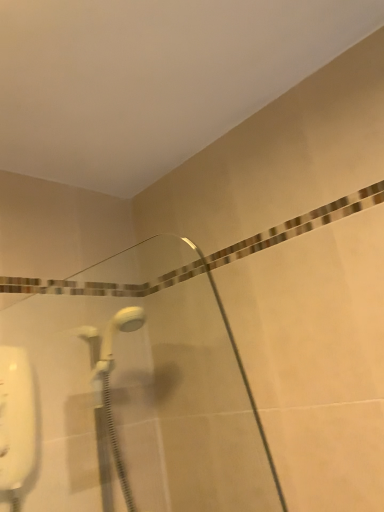
The image size is (384, 512). What do you see at coordinates (130, 392) in the screenshot?
I see `white glossy shower door at lower left` at bounding box center [130, 392].

Where is `white glossy shower door at lower left`? The height and width of the screenshot is (512, 384). white glossy shower door at lower left is located at coordinates pos(130,392).

Identify the location of white glossy shower door at lower left. The image size is (384, 512). (130, 392).